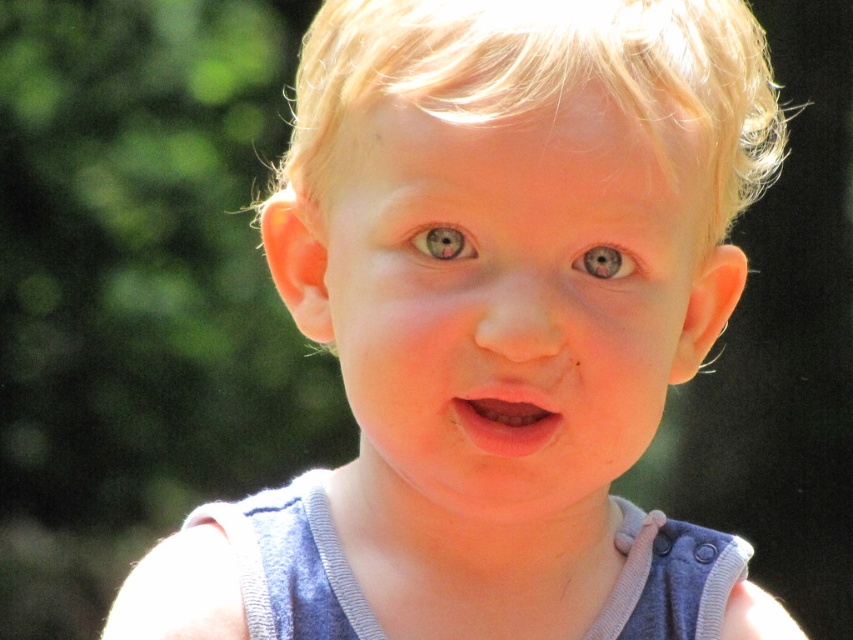
Does smooth skin face at center have a smaller size compared to matte gray eye at center?

No, smooth skin face at center is not smaller than matte gray eye at center.

Measure the distance between smooth skin face at center and camera.

They are 22.97 inches apart.

Image resolution: width=853 pixels, height=640 pixels. I want to click on smooth skin face at center, so click(509, 301).

Does point (647, 17) come behind point (454, 228)?

Yes, point (647, 17) is behind point (454, 228).

Where is `blonde silky hair at center`? The width and height of the screenshot is (853, 640). blonde silky hair at center is located at coordinates (548, 76).

Which of these two, blonde silky hair at center or pink matte lips at center, stands taller?

blonde silky hair at center is taller.

Is blonde silky hair at center above pink matte lips at center?

Indeed, blonde silky hair at center is positioned over pink matte lips at center.

Between point (489, 51) and point (508, 412), which one is positioned in front?

Point (489, 51) is in front.

At what (x,y) coordinates should I click in order to perform the action: click on blonde silky hair at center. Please return your answer as a coordinate pair (x, y). Image resolution: width=853 pixels, height=640 pixels. Looking at the image, I should click on (548, 76).